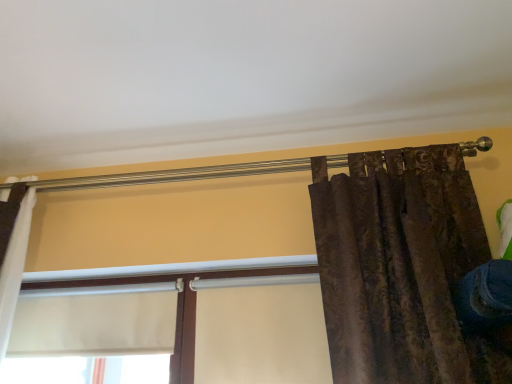
Question: Considering the positions of white matte window at center, the 2th window positioned from the right, and blue denim jeans at lower right in the image, is white matte window at center, the 2th window positioned from the right, bigger or smaller than blue denim jeans at lower right?

Choices:
 (A) big
 (B) small

Answer: (A)

Question: Visually, is white matte window at center, the 2th window positioned from the right, positioned to the left or to the right of blue denim jeans at lower right?

Choices:
 (A) right
 (B) left

Answer: (B)

Question: Estimate the real-world distances between objects in this image. Which object is farther from the blue denim jeans at lower right?

Choices:
 (A) white matte window at center, the 2th window positioned from the left
 (B) white matte window at center, the 2th window positioned from the right

Answer: (B)

Question: Considering the real-world distances, which object is farthest from the white matte window at center, the 2th window positioned from the left?

Choices:
 (A) white matte window at center, the 2th window positioned from the right
 (B) blue denim jeans at lower right

Answer: (B)